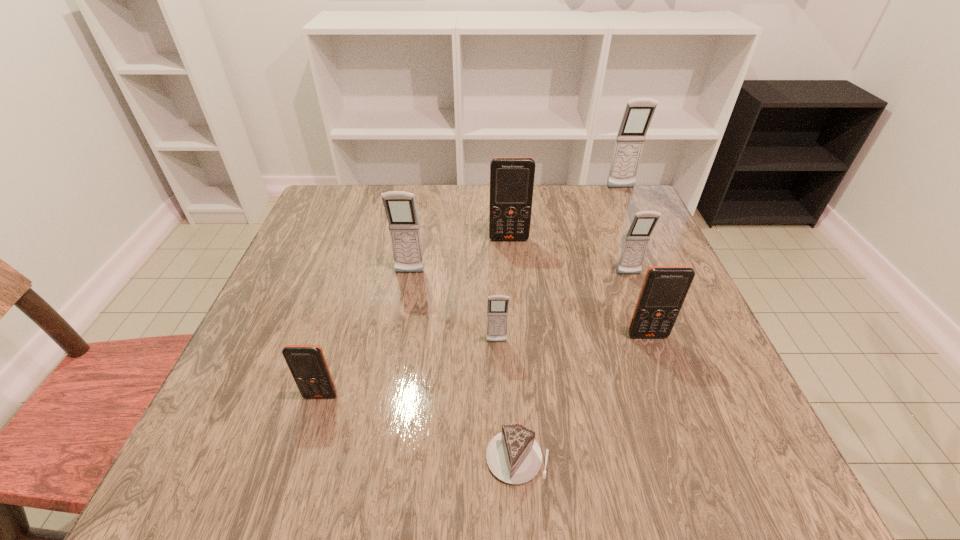
Identify the location of the second closest orange cellular telephone to the farthest orange cellular telephone. (307, 363).